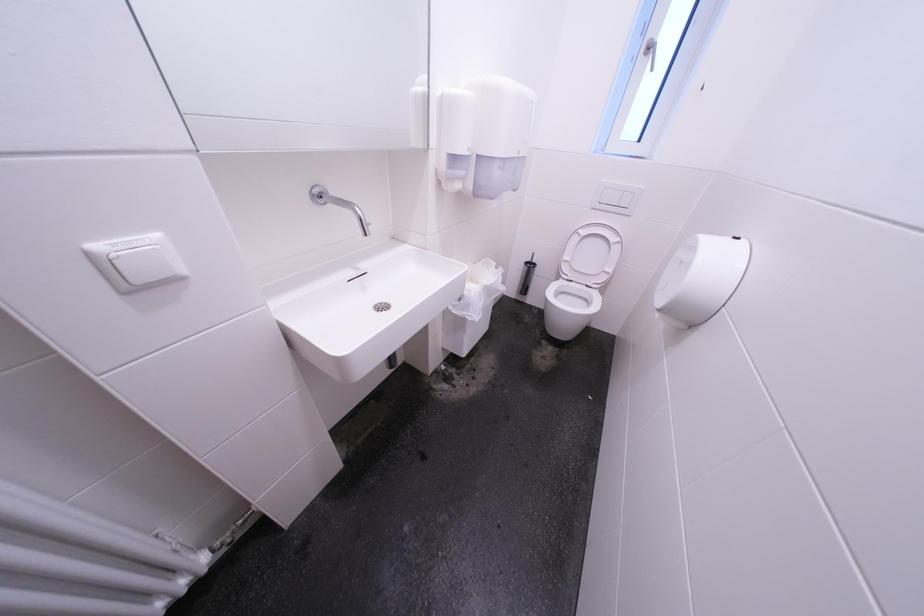
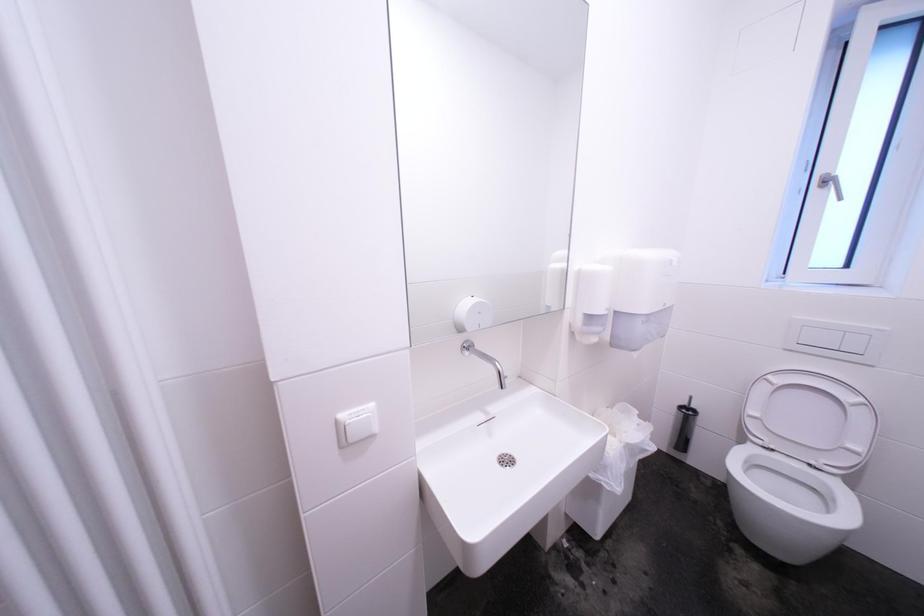
The images are taken continuously from a first-person perspective. In which direction is your viewpoint rotating?

The camera rotated toward left-up.